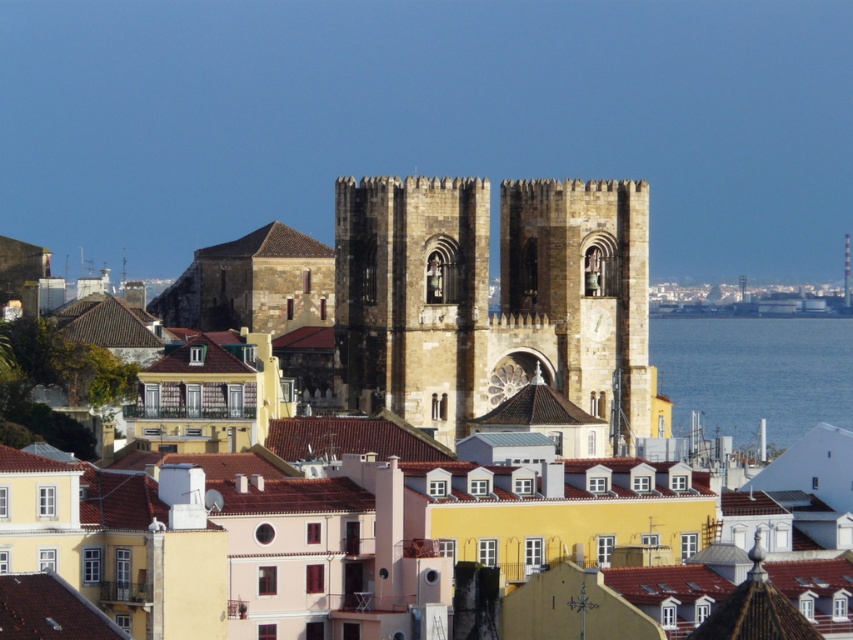
Question: Is brown stone tower at center bigger than brown stone clock tower at center?

Choices:
 (A) no
 (B) yes

Answer: (B)

Question: Which object appears farthest from the camera in this image?

Choices:
 (A) brown stone tower at center
 (B) brown stone church at center
 (C) brown stone clock tower at center

Answer: (C)

Question: Among these points, which one is farthest from the camera?

Choices:
 (A) (798, 352)
 (B) (613, 316)

Answer: (A)

Question: Which point is farther to the camera?

Choices:
 (A) blue water at right
 (B) brown stone tower at center

Answer: (A)

Question: Is brown stone church at center positioned before blue water at right?

Choices:
 (A) no
 (B) yes

Answer: (B)

Question: Is brown stone church at center wider than brown stone tower at center?

Choices:
 (A) no
 (B) yes

Answer: (B)